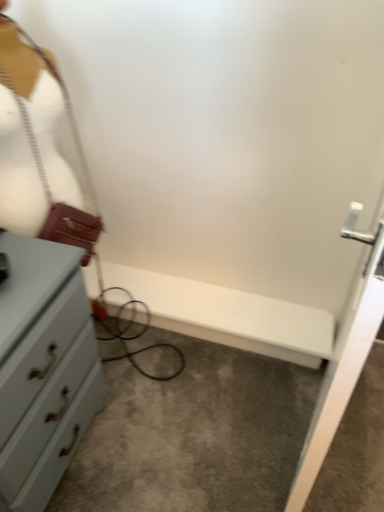
Question: Is leather-like white mannequin at left in front of or behind black cable at left in the image?

Choices:
 (A) front
 (B) behind

Answer: (B)

Question: In terms of width, does leather-like white mannequin at left look wider or thinner when compared to black cable at left?

Choices:
 (A) wide
 (B) thin

Answer: (B)

Question: Considering the positions of point (41, 206) and point (84, 159), is point (41, 206) closer or farther from the camera than point (84, 159)?

Choices:
 (A) farther
 (B) closer

Answer: (B)

Question: From a real-world perspective, is black cable at left above or below leather-like white mannequin at left?

Choices:
 (A) below
 (B) above

Answer: (A)

Question: Is point (177, 351) positioned closer to the camera than point (11, 53)?

Choices:
 (A) farther
 (B) closer

Answer: (A)

Question: In the image, is black cable at left positioned in front of or behind leather-like white mannequin at left?

Choices:
 (A) front
 (B) behind

Answer: (A)

Question: Looking at the image, does black cable at left seem bigger or smaller compared to leather-like white mannequin at left?

Choices:
 (A) small
 (B) big

Answer: (B)